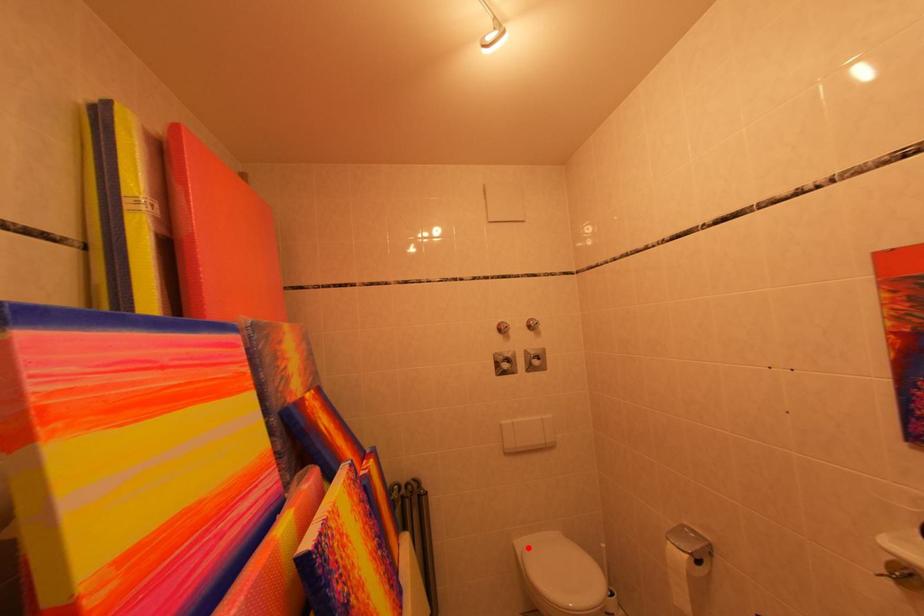
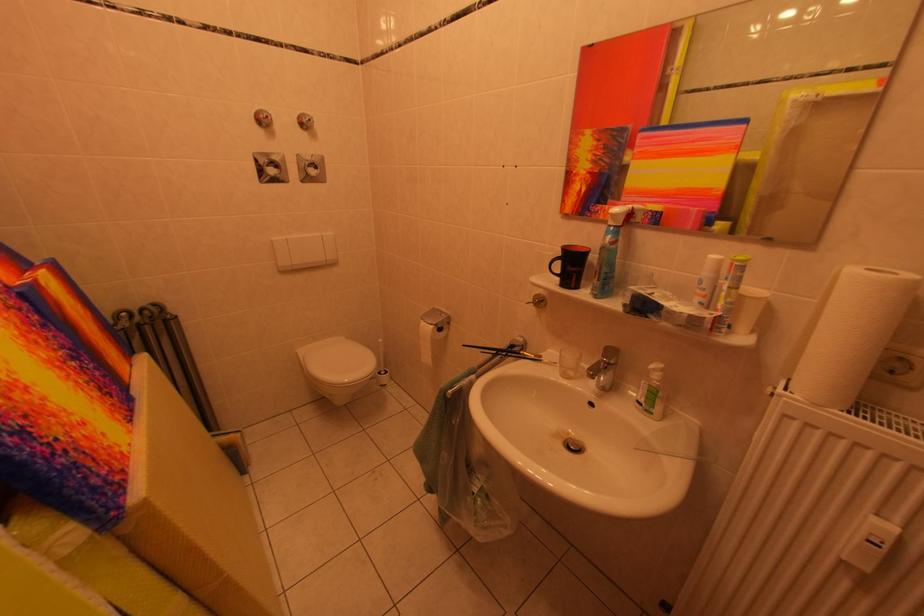
Where in the second image is the point corresponding to the highlighted location from the first image?

(311, 355)